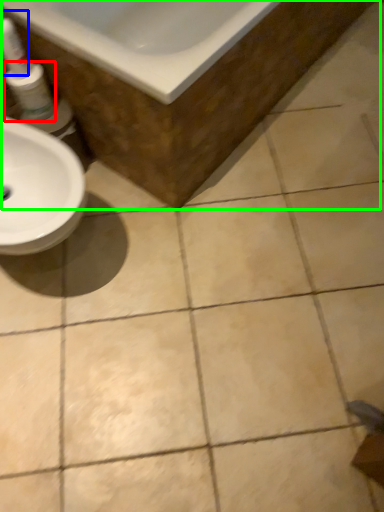
Question: Which object is the farthest from mouthwash (highlighted by a red box)? Choose among these: cleaning product (highlighted by a blue box) or bath (highlighted by a green box).

Choices:
 (A) cleaning product
 (B) bath

Answer: (B)